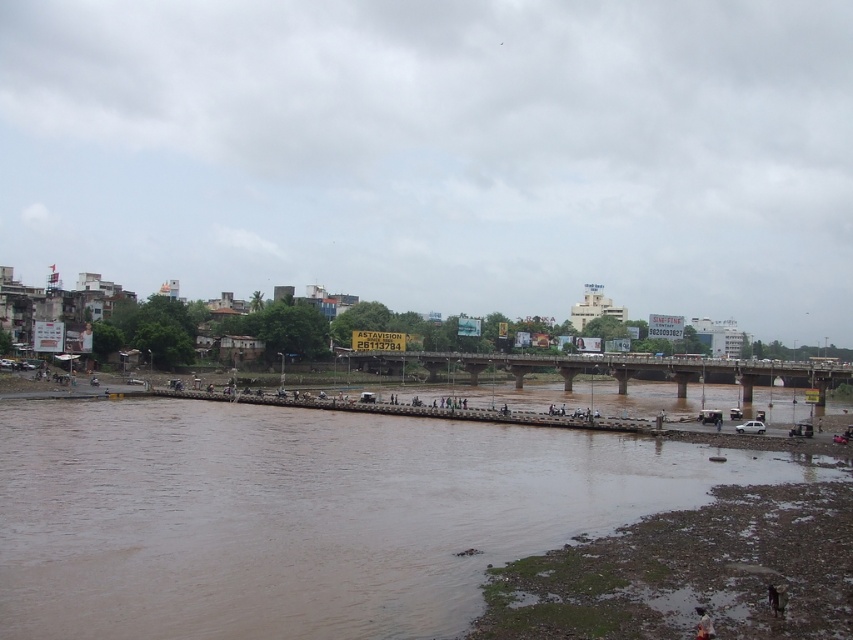
Does muddy sand at lower right have a smaller size compared to concrete bridge at center?

Yes.

Identify the location of muddy sand at lower right. (689, 572).

Who is more distant from viewer, [7,529] or [790,609]?

Point [7,529]

Does brown muddy water at lower left appear on the left side of muddy sand at lower right?

Correct, you'll find brown muddy water at lower left to the left of muddy sand at lower right.

Does point (463, 461) come in front of point (683, 634)?

No, it is behind (683, 634).

Where is `brown muddy water at lower left`? The height and width of the screenshot is (640, 853). brown muddy water at lower left is located at coordinates (305, 513).

Who is more forward, (x=59, y=602) or (x=358, y=365)?

Positioned in front is point (x=59, y=602).

Is point (115, 445) behind point (442, 360)?

No, it is in front of (442, 360).

This screenshot has height=640, width=853. I want to click on brown muddy water at lower left, so click(x=305, y=513).